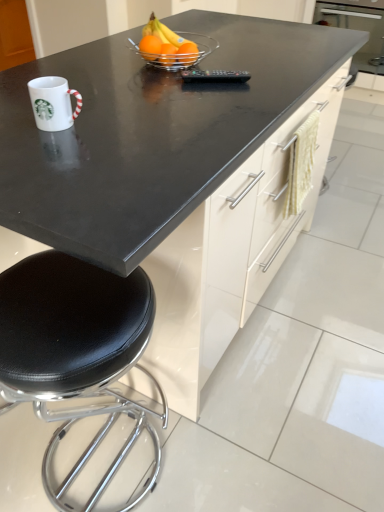
Find the location of a particular element. The width and height of the screenshot is (384, 512). empty space that is to the right of black plastic remote at center is located at coordinates tap(275, 77).